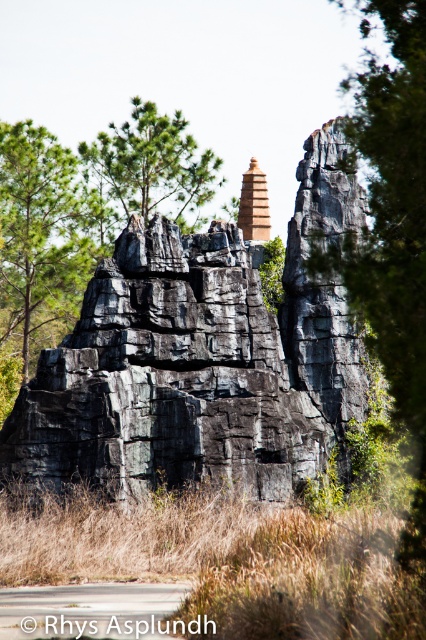
You are an explorer trying to locate the green matte tree at upper left from the black rough rock formation at center. Which direction should you move to find it?

The black rough rock formation at center is positioned on the right side of the green matte tree at upper left, so to locate the green matte tree at upper left, you should move to the left from the black rough rock formation at center.